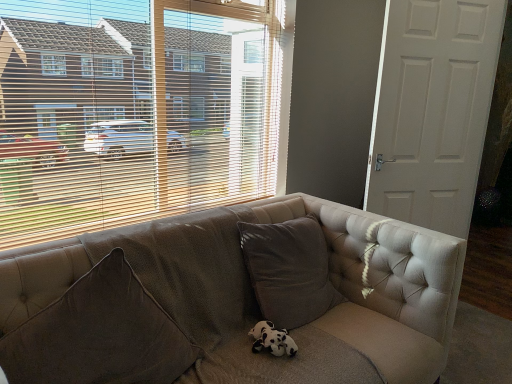
Image resolution: width=512 pixels, height=384 pixels. What do you see at coordinates (134, 111) in the screenshot?
I see `wooden blinds at upper left` at bounding box center [134, 111].

At what (x,y) coordinates should I click in order to perform the action: click on tufted fabric couch at center. Please return your answer as a coordinate pair (x, y). Looking at the image, I should click on (254, 294).

Describe the element at coordinates (254, 294) in the screenshot. I see `tufted fabric couch at center` at that location.

What do you see at coordinates (432, 110) in the screenshot?
I see `white matte door at right` at bounding box center [432, 110].

What do you see at coordinates (99, 335) in the screenshot? This screenshot has width=512, height=384. I see `brown textured pillow at lower left` at bounding box center [99, 335].

At what (x,y) coordinates should I click in order to perform the action: click on black and white plush at center. Please return your answer as a coordinate pair (x, y). Looking at the image, I should click on (272, 339).

Is wooden blinds at upper left completely or partially outside of white matte door at right?

Absolutely, wooden blinds at upper left is external to white matte door at right.

The width and height of the screenshot is (512, 384). In order to click on window that is on the left side of white matte door at right in this screenshot , I will do `click(134, 111)`.

How far apart are wooden blinds at upper left and white matte door at right?

They are 1.10 meters apart.

Could you tell me if wooden blinds at upper left is turned towards white matte door at right?

No, wooden blinds at upper left is not aimed at white matte door at right.

In terms of height, does wooden blinds at upper left look taller or shorter compared to tufted fabric couch at center?

Clearly, wooden blinds at upper left is taller compared to tufted fabric couch at center.

From the image's perspective, is wooden blinds at upper left above tufted fabric couch at center?

Yes.

Which point is more distant from viewer, (x=0, y=125) or (x=256, y=361)?

The point (x=0, y=125) is farther.

Considering the sizes of objects wooden blinds at upper left and tufted fabric couch at center in the image provided, who is wider, wooden blinds at upper left or tufted fabric couch at center?

tufted fabric couch at center is wider.

Measure the distance from white matte door at right to black and white plush at center.

A distance of 5.27 feet exists between white matte door at right and black and white plush at center.

Is white matte door at right outside of black and white plush at center?

Yes, white matte door at right is outside of black and white plush at center.

Considering the positions of objects white matte door at right and black and white plush at center in the image provided, who is more to the right, white matte door at right or black and white plush at center?

Positioned to the right is white matte door at right.

From the image's perspective, between white matte door at right and black and white plush at center, which one is located above?

From the image's view, white matte door at right is above.

Consider the image. From the image's perspective, relative to tufted fabric couch at center, is brown textured pillow at lower left above or below?

Based on their image positions, brown textured pillow at lower left is located above tufted fabric couch at center.

Is brown textured pillow at lower left inside the boundaries of tufted fabric couch at center, or outside?

brown textured pillow at lower left can be found inside tufted fabric couch at center.

Is wooden blinds at upper left aimed at brown textured pillow at lower left?

Yes, wooden blinds at upper left faces towards brown textured pillow at lower left.

Does wooden blinds at upper left have a larger size compared to brown textured pillow at lower left?

No, wooden blinds at upper left is not bigger than brown textured pillow at lower left.

Is point (89, 40) positioned in front of point (173, 365)?

No, it is behind (173, 365).

Is brown textured pillow at lower left to the left or to the right of black and white plush at center in the image?

Based on their positions, brown textured pillow at lower left is located to the left of black and white plush at center.

Can we say brown textured pillow at lower left lies outside black and white plush at center?

brown textured pillow at lower left is positioned outside black and white plush at center.

Is brown textured pillow at lower left facing away from black and white plush at center?

brown textured pillow at lower left is not turned away from black and white plush at center.

Between black and white plush at center and tufted fabric couch at center, which one is positioned behind?

black and white plush at center is more distant.

From a real-world perspective, which is physically below, black and white plush at center or tufted fabric couch at center?

From a 3D spatial view, black and white plush at center is below.

At what (x,y) coordinates should I click in order to perform the action: click on studio couch above the black and white plush at center (from a real-world perspective). Please return your answer as a coordinate pair (x, y). This screenshot has width=512, height=384. Looking at the image, I should click on (254, 294).

Does point (286, 332) come farther from viewer compared to point (156, 278)?

That is True.

I want to click on window on the left side of white matte door at right, so 134,111.

Locate an element on the screen. window that is above the tufted fabric couch at center (from the image's perspective) is located at coordinates (134, 111).

From the image, which object appears to be farther from white matte door at right, wooden blinds at upper left or black and white plush at center?

black and white plush at center.

When comparing their distances from white matte door at right, does wooden blinds at upper left or brown textured pillow at lower left seem further?

Based on the image, brown textured pillow at lower left appears to be further to white matte door at right.

Considering their positions, is tufted fabric couch at center positioned closer to white matte door at right than wooden blinds at upper left?

Based on the image, tufted fabric couch at center appears to be nearer to white matte door at right.

When comparing their distances from brown textured pillow at lower left, does tufted fabric couch at center or white matte door at right seem closer?

tufted fabric couch at center lies closer to brown textured pillow at lower left than the other object.

Considering their positions, is black and white plush at center positioned closer to white matte door at right than tufted fabric couch at center?

tufted fabric couch at center lies closer to white matte door at right than the other object.

When comparing their distances from brown textured pillow at lower left, does black and white plush at center or white matte door at right seem closer?

black and white plush at center is closer to brown textured pillow at lower left.

Which object lies nearer to the anchor point wooden blinds at upper left, black and white plush at center or white matte door at right?

white matte door at right is positioned closer to the anchor wooden blinds at upper left.

From the image, which object appears to be nearer to white matte door at right, black and white plush at center or wooden blinds at upper left?

wooden blinds at upper left is closer to white matte door at right.

Find the location of a particular element. pillow that lies between wooden blinds at upper left and tufted fabric couch at center from top to bottom is located at coordinates (99, 335).

You are a GUI agent. You are given a task and a screenshot of the screen. Output one action in this format:
    pyautogui.click(x=<x>, y=<y>)
    Task: Click on the animal between wooden blinds at upper left and white matte door at right from left to right
    
    Given the screenshot: What is the action you would take?
    pyautogui.click(x=272, y=339)

Find the location of a particular element. Image resolution: width=512 pixels, height=384 pixels. studio couch between brown textured pillow at lower left and white matte door at right from left to right is located at coordinates (254, 294).

What are the coordinates of `animal between tufted fabric couch at center and white matte door at right from front to back` in the screenshot? It's located at (272, 339).